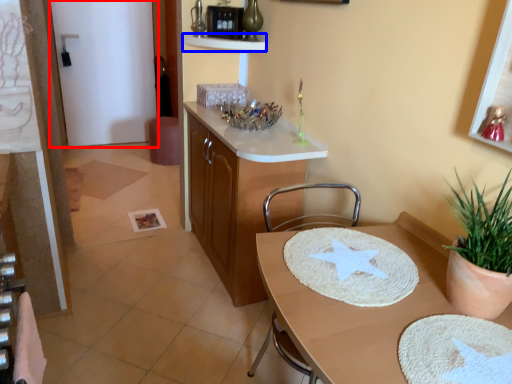
Question: Which of the following is the closest to the observer, glass door (highlighted by a red box) or shelf (highlighted by a blue box)?

Choices:
 (A) glass door
 (B) shelf

Answer: (B)